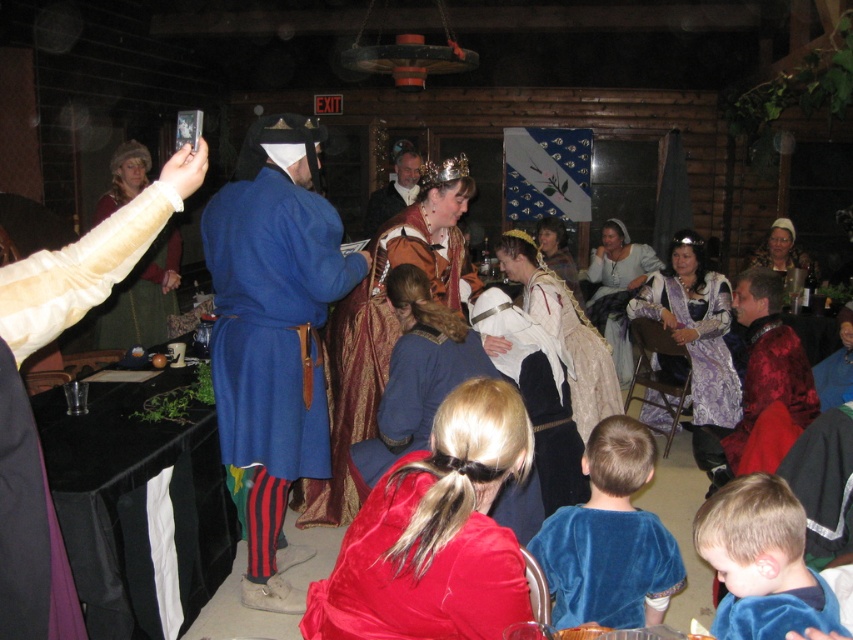
Which is more to the right, velvet red robe at center or velvet blue tunic at lower right?

Positioned to the right is velvet blue tunic at lower right.

Is velvet red robe at center behind velvet blue tunic at lower right?

No, velvet red robe at center is closer to the viewer.

Describe the element at coordinates (419, 577) in the screenshot. I see `velvet red robe at center` at that location.

In order to click on velvet red robe at center in this screenshot , I will do `click(419, 577)`.

Can you confirm if velvet blue shirt at lower right is smaller than smooth blue robe at center?

Indeed, velvet blue shirt at lower right has a smaller size compared to smooth blue robe at center.

What are the coordinates of `velvet blue shirt at lower right` in the screenshot? It's located at (761, 561).

Locate an element on the screen. blue woolen robe at center is located at coordinates (273, 336).

Based on the photo, between blue woolen robe at center and smooth blue robe at center, which one has less height?

smooth blue robe at center is shorter.

Where is `blue woolen robe at center`? The height and width of the screenshot is (640, 853). blue woolen robe at center is located at coordinates (273, 336).